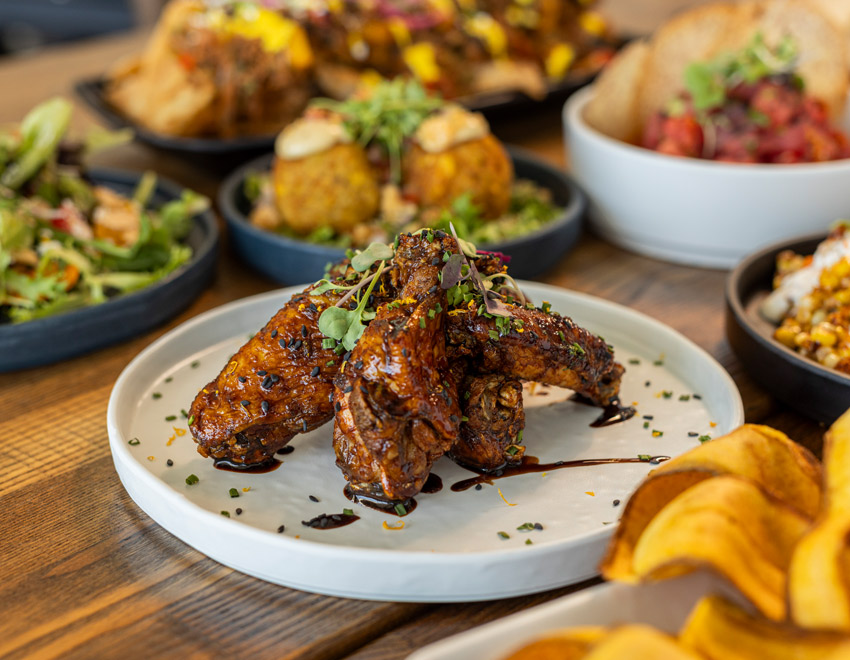
Locate an element on the screen. This screenshot has height=660, width=850. plates is located at coordinates (649, 385), (788, 369), (564, 222), (104, 321), (502, 626).